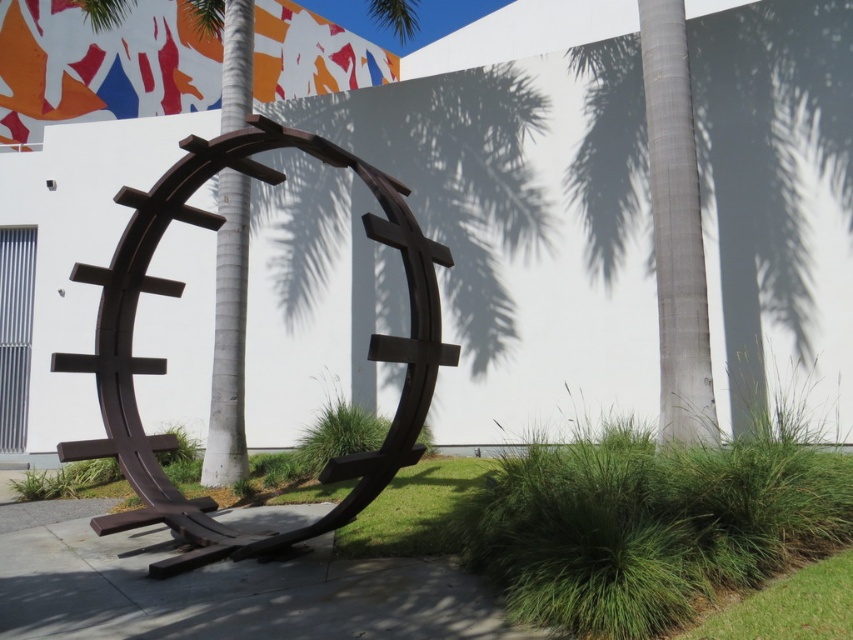
You are standing in front of the brown metal sculpture at center and want to take a photo of the smooth gray palm tree at right. Which direction should you turn to face the palm tree?

The smooth gray palm tree at right is located to the right of the brown metal sculpture at center, so you should turn to your right to face it.

You are an artist planning to paint the smooth gray palm tree at right and the brown metal sculpture at center. Based on their sizes, which object should you focus on first if you want to paint the taller one first?

The brown metal sculpture at center is taller than the smooth gray palm tree at right, so you should focus on painting the brown metal sculpture at center first.

You are standing in front of the sculpture and want to take a photo of the smooth gray palm tree at right. Where should you position yourself to ensure the palm tree is fully visible in your camera frame?

You should position yourself to the left of the sculpture so that the smooth gray palm tree at right is fully visible in your camera frame.